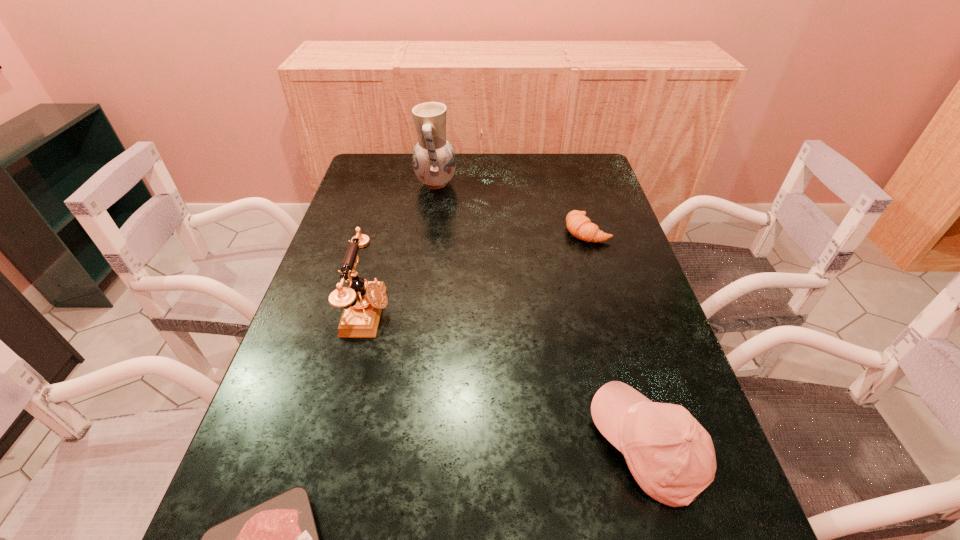
The width and height of the screenshot is (960, 540). Identify the location of the farthest object. (434, 161).

Locate an element on the screen. Image resolution: width=960 pixels, height=540 pixels. pottery is located at coordinates tap(434, 161).

Locate an element on the screen. The image size is (960, 540). the fourth shortest object is located at coordinates (363, 301).

Locate an element on the screen. This screenshot has height=540, width=960. the third nearest object is located at coordinates (363, 301).

Locate an element on the screen. This screenshot has width=960, height=540. the third shortest object is located at coordinates (671, 456).

Locate an element on the screen. The width and height of the screenshot is (960, 540). the fourth nearest object is located at coordinates (580, 226).

Find the location of `crescent roll`. crescent roll is located at coordinates (580, 226).

Where is `free space located on either side of the tallest object`? The image size is (960, 540). free space located on either side of the tallest object is located at coordinates (522, 184).

Where is `blank space located on the dial of the telephone`? Image resolution: width=960 pixels, height=540 pixels. blank space located on the dial of the telephone is located at coordinates (534, 313).

Image resolution: width=960 pixels, height=540 pixels. What are the coordinates of `free location located 0.230m on the front-facing side of the baseball cap` in the screenshot? It's located at (469, 447).